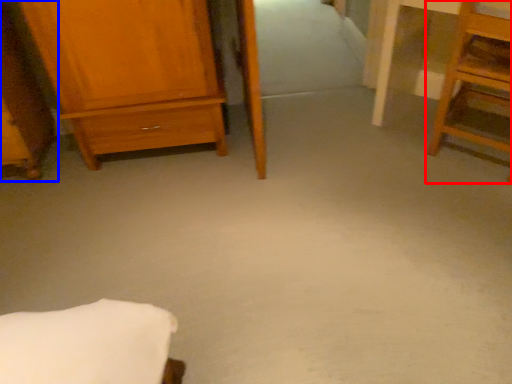
Question: Which point is closer to the camera, furniture (highlighted by a red box) or furniture (highlighted by a blue box)?

Choices:
 (A) furniture
 (B) furniture

Answer: (A)